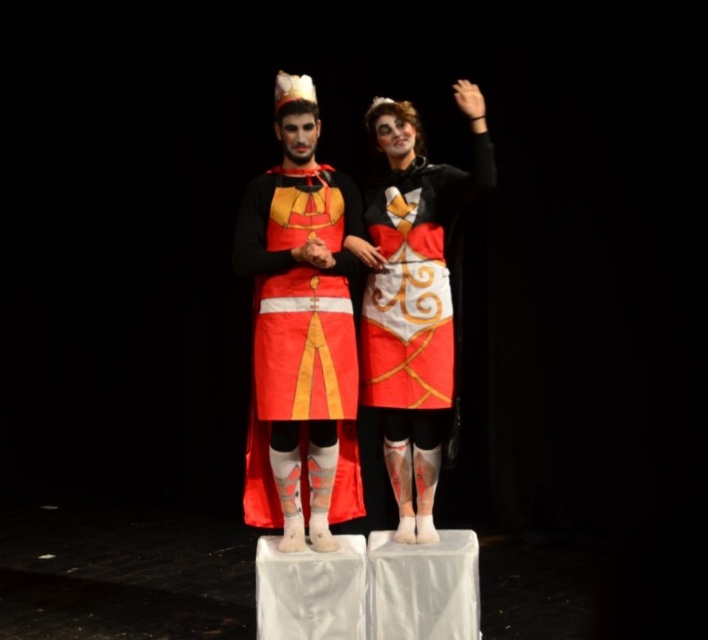
Question: Is matte black costume at center bigger than matte black hand at center?

Choices:
 (A) no
 (B) yes

Answer: (B)

Question: Which object is positioned closest to the matte red fabric cape at center?

Choices:
 (A) matte black hand at center
 (B) matte black costume at center

Answer: (B)

Question: Which point is closer to the camera taking this photo?

Choices:
 (A) (416, 296)
 (B) (319, 188)
 (C) (312, 260)

Answer: (C)

Question: Which point is farther to the camera?

Choices:
 (A) (312, 237)
 (B) (285, 387)

Answer: (B)

Question: Is matte red fabric cape at center bigger than matte black hand at center?

Choices:
 (A) yes
 (B) no

Answer: (A)

Question: Can you confirm if matte red fabric cape at center is smaller than matte black hand at center?

Choices:
 (A) no
 (B) yes

Answer: (A)